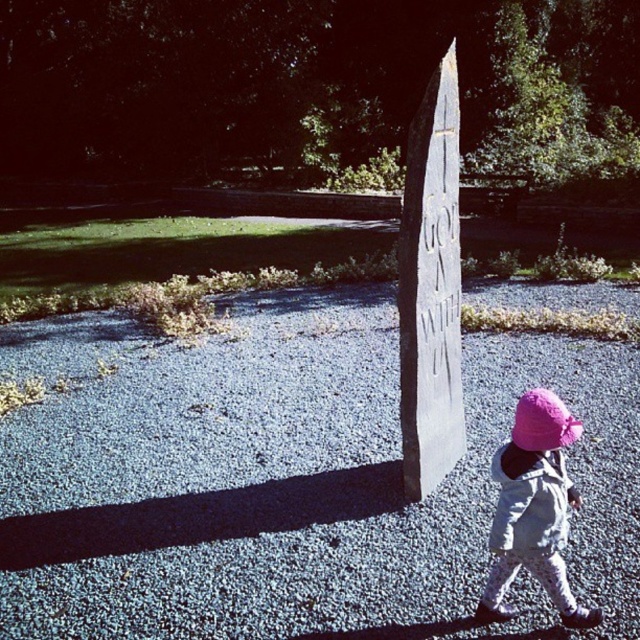
Question: Is gray stone monument at center to the right of pink fabric hat at lower right from the viewer's perspective?

Choices:
 (A) yes
 (B) no

Answer: (B)

Question: Which point appears farthest from the camera in this image?

Choices:
 (A) (554, 417)
 (B) (513, 557)

Answer: (B)

Question: Is the position of gray stone monument at center less distant than that of pink fabric hat at lower right?

Choices:
 (A) no
 (B) yes

Answer: (A)

Question: Which point appears farthest from the camera in this image?

Choices:
 (A) (209, 392)
 (B) (568, 436)
 (C) (529, 451)

Answer: (A)

Question: Is gray gravel at center closer to camera compared to gray stone monument at center?

Choices:
 (A) yes
 (B) no

Answer: (B)

Question: Which of the following is the closest to the observer?

Choices:
 (A) (552, 454)
 (B) (621, 292)
 (C) (573, 428)
 (D) (408, 182)

Answer: (C)